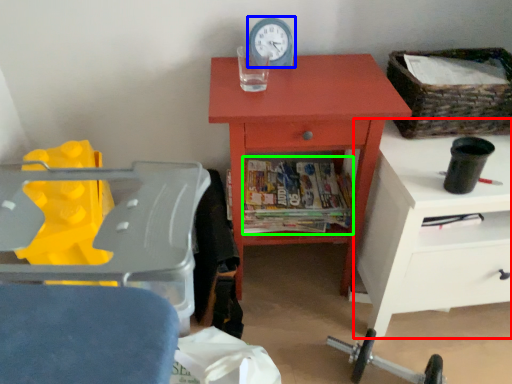
Question: Which object is positioned closest to nightstand (highlighted by a red box)? Select from clock (highlighted by a blue box) and magazine (highlighted by a green box).

Choices:
 (A) clock
 (B) magazine

Answer: (B)